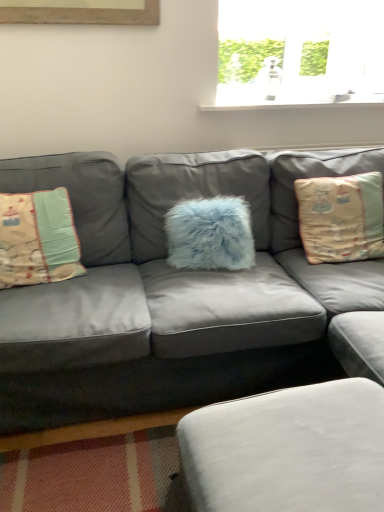
Question: Should I look upward or downward to see beige fabric pillow at left, the 3th pillow positioned from the right?

Choices:
 (A) down
 (B) up

Answer: (B)

Question: Is fluffy blue pillow at center, the second pillow viewed from the right, not close to beige fabric pillow at right, arranged as the 3th pillow when viewed from the left?

Choices:
 (A) no
 (B) yes

Answer: (A)

Question: Is fluffy blue pillow at center, the second pillow viewed from the right, to the left of beige fabric pillow at right, the first pillow positioned from the right, from the viewer's perspective?

Choices:
 (A) yes
 (B) no

Answer: (A)

Question: From the image's perspective, is fluffy blue pillow at center, the second pillow viewed from the right, located beneath beige fabric pillow at right, arranged as the 3th pillow when viewed from the left?

Choices:
 (A) no
 (B) yes

Answer: (B)

Question: Is fluffy blue pillow at center, the second pillow viewed from the right, not inside beige fabric pillow at right, the first pillow positioned from the right?

Choices:
 (A) yes
 (B) no

Answer: (A)

Question: Is beige fabric pillow at right, the first pillow positioned from the right, at the back of fluffy blue pillow at center, the second pillow viewed from the right?

Choices:
 (A) no
 (B) yes

Answer: (A)

Question: From a real-world perspective, is fluffy blue pillow at center, the second pillow viewed from the right, physically above beige fabric pillow at right, the first pillow positioned from the right?

Choices:
 (A) no
 (B) yes

Answer: (A)

Question: Is fluffy blue pillow at center, which is the second pillow in left-to-right order, at the left side of beige fabric pillow at left, the 3th pillow positioned from the right?

Choices:
 (A) yes
 (B) no

Answer: (B)

Question: Could you tell me if fluffy blue pillow at center, the second pillow viewed from the right, is turned towards beige fabric pillow at left, the 3th pillow positioned from the right?

Choices:
 (A) yes
 (B) no

Answer: (B)

Question: Is beige fabric pillow at left, the 3th pillow positioned from the right, a part of fluffy blue pillow at center, the second pillow viewed from the right?

Choices:
 (A) yes
 (B) no

Answer: (B)

Question: Is there a large distance between fluffy blue pillow at center, the second pillow viewed from the right, and beige fabric pillow at left, the first pillow in the left-to-right sequence?

Choices:
 (A) no
 (B) yes

Answer: (A)

Question: From a real-world perspective, is fluffy blue pillow at center, the second pillow viewed from the right, located beneath beige fabric pillow at left, the 3th pillow positioned from the right?

Choices:
 (A) no
 (B) yes

Answer: (B)

Question: From the image's perspective, is fluffy blue pillow at center, the second pillow viewed from the right, over beige fabric pillow at left, the first pillow in the left-to-right sequence?

Choices:
 (A) no
 (B) yes

Answer: (B)

Question: Does matte gray couch at center lie behind white fabric footrest at lower center?

Choices:
 (A) yes
 (B) no

Answer: (A)